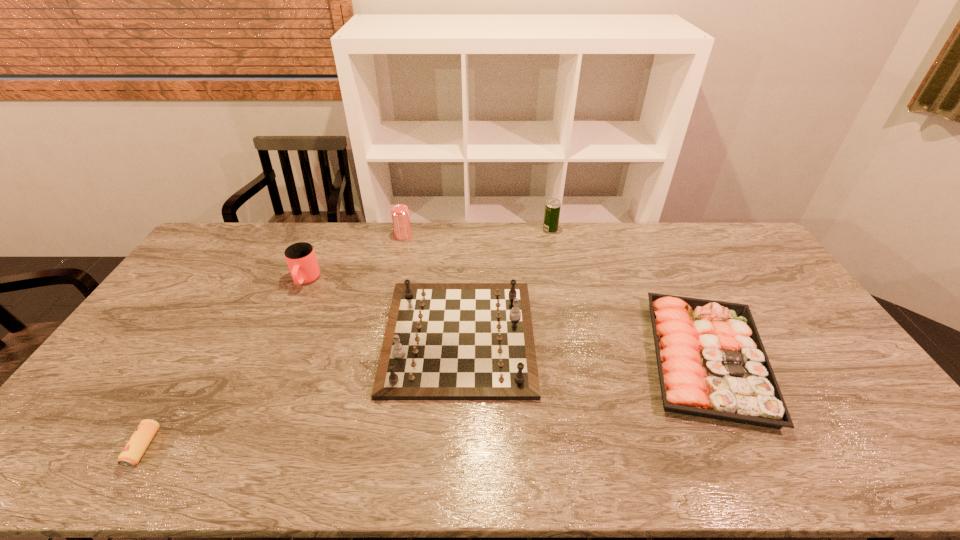
You are a GUI agent. You are given a task and a screenshot of the screen. Output one action in this format:
    pyautogui.click(x=<x>, y=<y>)
    Task: Click on the second object from right to left
    
    Given the screenshot: What is the action you would take?
    pyautogui.click(x=553, y=205)

Where is `the second beer can from right to left`? This screenshot has height=540, width=960. the second beer can from right to left is located at coordinates (400, 213).

This screenshot has height=540, width=960. I want to click on cup, so click(x=301, y=259).

Locate an element on the screen. The width and height of the screenshot is (960, 540). the fourth tallest object is located at coordinates (443, 341).

Locate an element on the screen. This screenshot has width=960, height=540. the fifth tallest object is located at coordinates (712, 363).

You are a GUI agent. You are given a task and a screenshot of the screen. Output one action in this format:
    pyautogui.click(x=<x>, y=<y>)
    Task: Click on the rightmost object
    This screenshot has height=540, width=960.
    Given the screenshot: What is the action you would take?
    pyautogui.click(x=712, y=363)

Find the location of a particular element. the shortest object is located at coordinates (131, 454).

At what (x,y) coordinates should I click in order to perform the action: click on the leftmost beer can. Please return your answer as a coordinate pair (x, y). Looking at the image, I should click on (131, 454).

Where is `vacant position located 0.340m on the right of the rightmost beer can`? This screenshot has height=540, width=960. vacant position located 0.340m on the right of the rightmost beer can is located at coordinates (644, 230).

Where is `free location located on the right of the second beer can from left to right`? This screenshot has width=960, height=540. free location located on the right of the second beer can from left to right is located at coordinates (x=441, y=236).